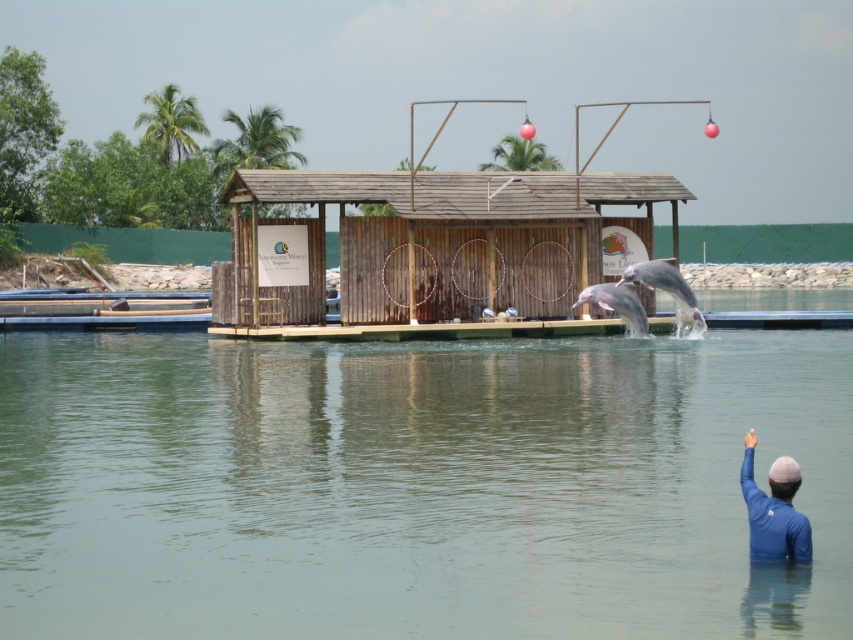
Which is below, blue fabric arm at lower right or pink smooth dolphin at center?

blue fabric arm at lower right is lower down.

Who is higher up, blue fabric arm at lower right or pink smooth dolphin at center?

Positioned higher is pink smooth dolphin at center.

What do you see at coordinates (773, 513) in the screenshot? I see `blue fabric arm at lower right` at bounding box center [773, 513].

Image resolution: width=853 pixels, height=640 pixels. What are the coordinates of `blue fabric arm at lower right` in the screenshot? It's located at (773, 513).

Does clear water at center have a greater width compared to blue fabric arm at lower right?

Correct, the width of clear water at center exceeds that of blue fabric arm at lower right.

Based on the photo, can you confirm if clear water at center is taller than blue fabric arm at lower right?

Correct, clear water at center is much taller as blue fabric arm at lower right.

Between point (589, 518) and point (769, 509), which one is positioned behind?

Point (589, 518)

This screenshot has height=640, width=853. I want to click on clear water at center, so click(x=416, y=486).

Who is shorter, blue fabric arm at lower right or light gray smooth dolphin at center?

blue fabric arm at lower right is shorter.

Which is in front, point (740, 483) or point (692, 292)?

Point (740, 483) is in front.

Where is `blue fabric arm at lower right`? The width and height of the screenshot is (853, 640). blue fabric arm at lower right is located at coordinates (773, 513).